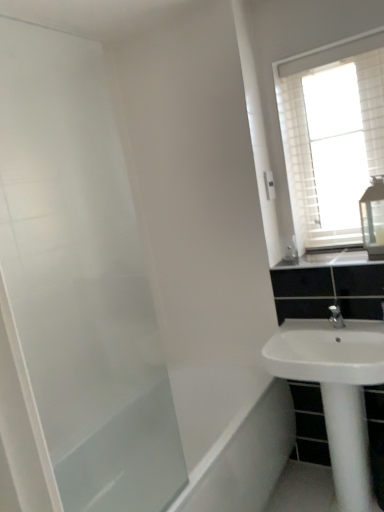
Question: From the image's perspective, is clear glass medicine cabinet at upper right located above or below transparent glass screen door at left?

Choices:
 (A) below
 (B) above

Answer: (B)

Question: Which is correct: clear glass medicine cabinet at upper right is inside transparent glass screen door at left, or outside of it?

Choices:
 (A) inside
 (B) outside

Answer: (B)

Question: Which object is positioned closest to the white glossy sink at upper right?

Choices:
 (A) white glossy sink at lower right
 (B) white textured window at upper right
 (C) clear glass medicine cabinet at upper right
 (D) transparent glass screen door at left

Answer: (C)

Question: Which of these objects is positioned farthest from the white textured window at upper right?

Choices:
 (A) white glossy sink at lower right
 (B) clear glass medicine cabinet at upper right
 (C) transparent glass screen door at left
 (D) white glossy sink at upper right

Answer: (C)